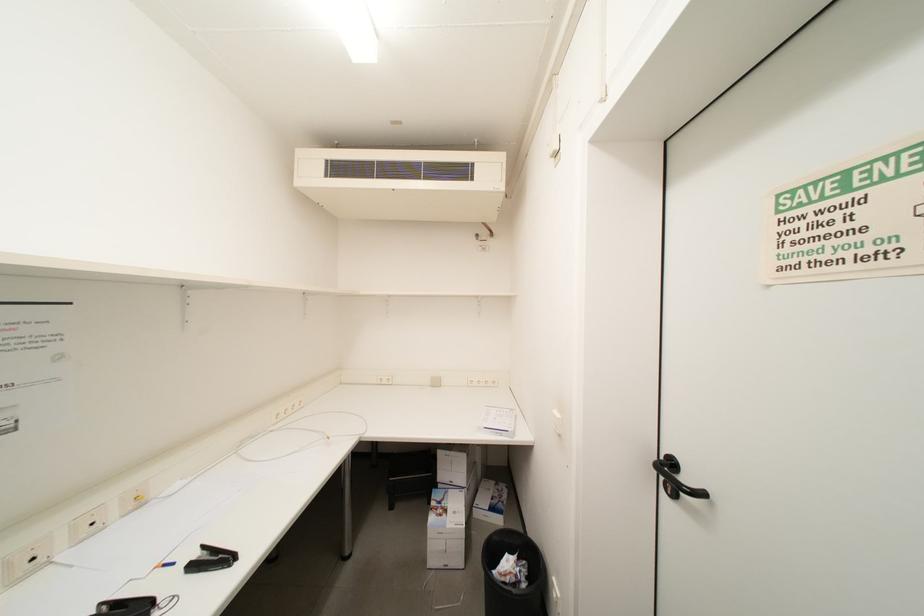
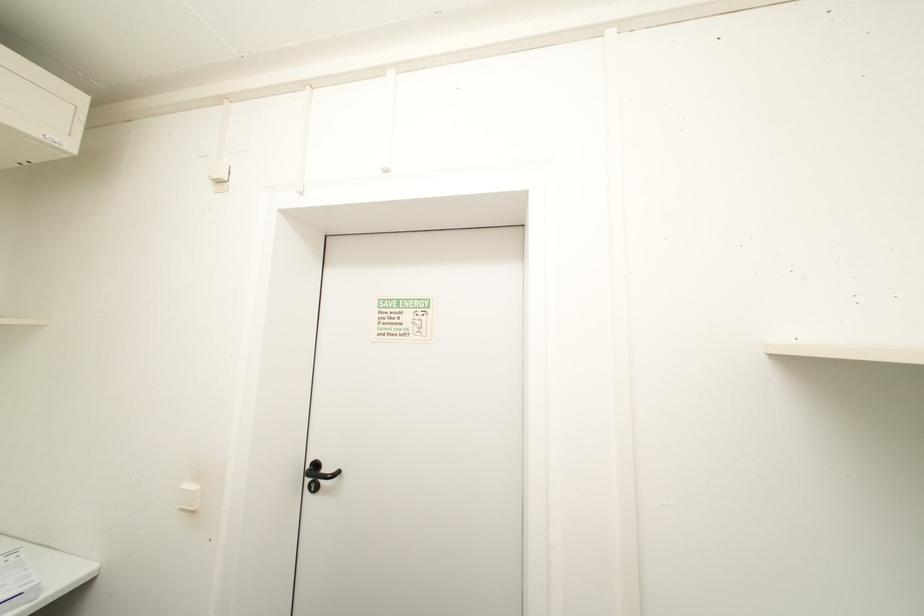
Question: The camera is either moving clockwise (left) or counter-clockwise (right) around the object. The first image is from the beginning of the video and the second image is from the end. Is the camera moving left or right when shooting the video?

Choices:
 (A) Left
 (B) Right

Answer: (A)